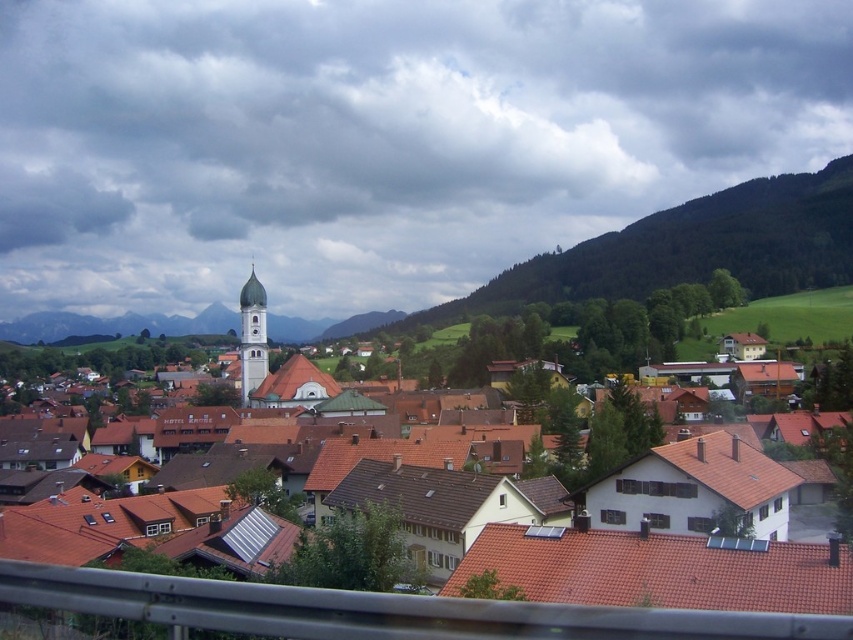
Question: Which is nearer to the green forested mountain at upper center?

Choices:
 (A) light gray stone bell tower at center
 (B) brown tiled roofs at center

Answer: (A)

Question: Can you confirm if brown tiled roofs at center is wider than green forested mountain at upper center?

Choices:
 (A) no
 (B) yes

Answer: (A)

Question: Which of the following is the farthest from the observer?

Choices:
 (A) brown tiled roofs at center
 (B) light gray stone bell tower at center

Answer: (B)

Question: Is brown tiled roofs at center below light gray stone bell tower at center?

Choices:
 (A) no
 (B) yes

Answer: (B)

Question: Is brown tiled roofs at center positioned before light gray stone bell tower at center?

Choices:
 (A) no
 (B) yes

Answer: (B)

Question: Which point is farther from the camera taking this photo?

Choices:
 (A) (160, 595)
 (B) (254, 294)
 (C) (630, 232)

Answer: (C)